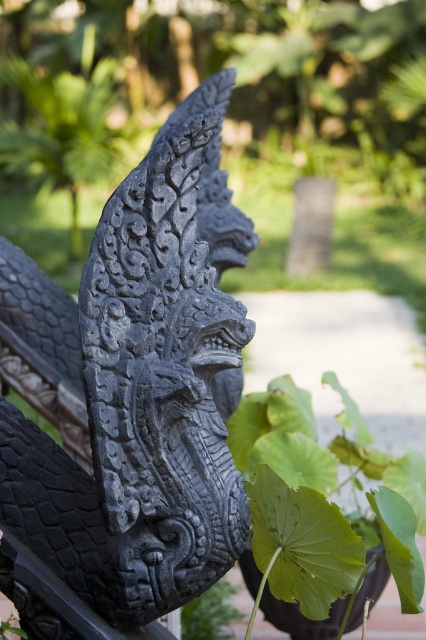
You are a maintenance worker needing to clean both the black stone dragon head at center and the green leafy plant at lower center. You have a 1.5 meter long pole with a sponge attached. If you are standing at the same spot, can you reach both objects with the pole?

The distance between the black stone dragon head at center and the green leafy plant at lower center is 1.02 meters. Since the pole is 1.5 meters long, which is longer than the distance between them, you can reach both objects with the pole.

You are an architect designing a new garden and want to place a plant with large heart shaped leaves in front of a dragon head sculpture. Based on the image, where should you position the plant relative to the black stone dragon head at center to match the original scene?

The plant should be placed in the foreground relative to the black stone dragon head at center to match the original scene.

You are a photographer adjusting your camera focus. You have two points in the scene you need to focus on, point (420, 484) and point (189, 621). Which point should you focus on first if you want to ensure the closest object is in sharp focus?

Point (420, 484) is closer to the camera than point (189, 621), so you should focus on point (420, 484) first to ensure the closest object is in sharp focus.